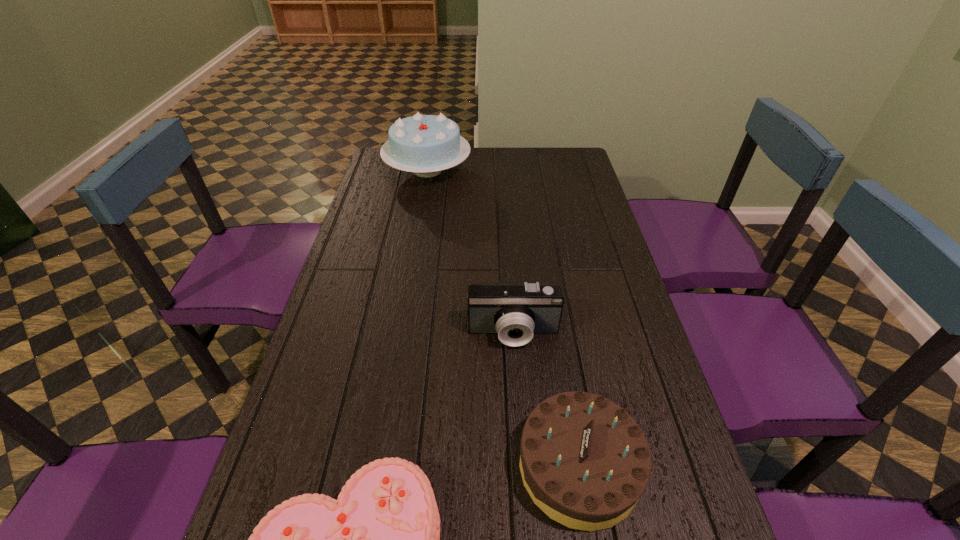
At what (x,y) coordinates should I click in order to perform the action: click on object positioned at the far edge. Please return your answer as a coordinate pair (x, y). The height and width of the screenshot is (540, 960). Looking at the image, I should click on (423, 144).

Identify the location of object that is at the left edge. This screenshot has height=540, width=960. (x=423, y=144).

At what (x,y) coordinates should I click in order to perform the action: click on object that is at the right edge. Please return your answer as a coordinate pair (x, y). Looking at the image, I should click on (584, 461).

Image resolution: width=960 pixels, height=540 pixels. Find the location of `object positioned at the far left corner`. object positioned at the far left corner is located at coordinates (423, 144).

You are a GUI agent. You are given a task and a screenshot of the screen. Output one action in this format:
    pyautogui.click(x=<x>, y=<y>)
    Task: Click on the blank space at the far edge of the desktop
    This screenshot has height=540, width=960.
    Given the screenshot: What is the action you would take?
    pyautogui.click(x=540, y=175)

Locate an element on the screen. The width and height of the screenshot is (960, 540). vacant area at the left edge of the desktop is located at coordinates (288, 474).

This screenshot has height=540, width=960. What are the coordinates of `free space at the right edge` in the screenshot? It's located at click(x=673, y=536).

This screenshot has height=540, width=960. In the image, there is a desktop. Find the location of `vacant space at the far left corner`. vacant space at the far left corner is located at coordinates (406, 174).

I want to click on vacant space at the far right corner, so click(x=545, y=159).

Where is `vacant area between the third nearest object and the left birthday cake`? The width and height of the screenshot is (960, 540). vacant area between the third nearest object and the left birthday cake is located at coordinates (470, 252).